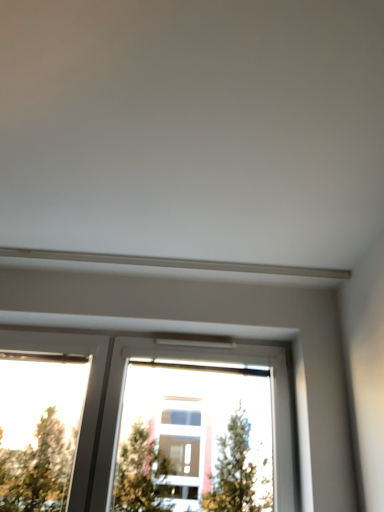
Measure the distance between transparent glass window at lower center and camera.

transparent glass window at lower center and camera are 5.78 feet apart from each other.

What do you see at coordinates (143, 424) in the screenshot?
I see `transparent glass window at lower center` at bounding box center [143, 424].

Where is `transparent glass window at lower center`? transparent glass window at lower center is located at coordinates (143, 424).

Measure the distance between point (54, 370) and camera.

3.25 meters.

Find the location of a particular element. transparent glass window at lower center is located at coordinates (143, 424).